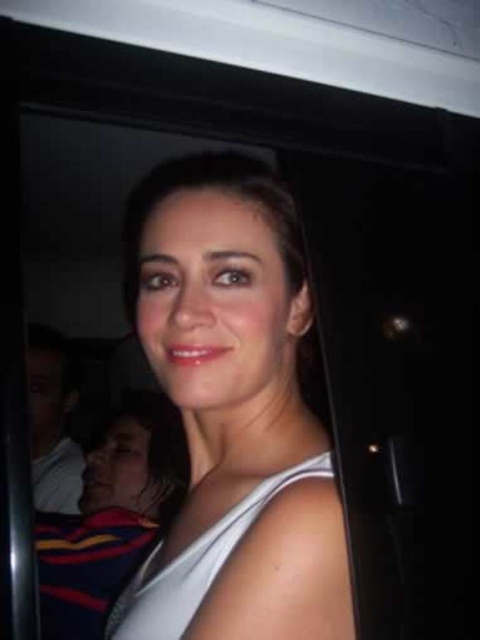
Is striped jersey at lower left smaller than white matte dress at center?

Incorrect, striped jersey at lower left is not smaller in size than white matte dress at center.

Does point (158, 525) lie behind point (187, 547)?

That is True.

Does point (179, 483) lie behind point (168, 564)?

Yes.

The width and height of the screenshot is (480, 640). I want to click on striped jersey at lower left, so click(x=110, y=516).

Measure the distance from white matte tank top at center to white matte dress at center.

white matte tank top at center and white matte dress at center are 2.71 inches apart.

Can you confirm if white matte tank top at center is positioned above white matte dress at center?

Correct, white matte tank top at center is located above white matte dress at center.

Which is in front, point (230, 481) or point (192, 577)?

Positioned in front is point (192, 577).

Identify the location of white matte tank top at center. (232, 412).

The width and height of the screenshot is (480, 640). Find the location of `white matte tank top at center`. white matte tank top at center is located at coordinates (232, 412).

Who is more forward, (271,476) or (183,456)?

Point (271,476)

Where is `white matte tank top at center`? white matte tank top at center is located at coordinates (232, 412).